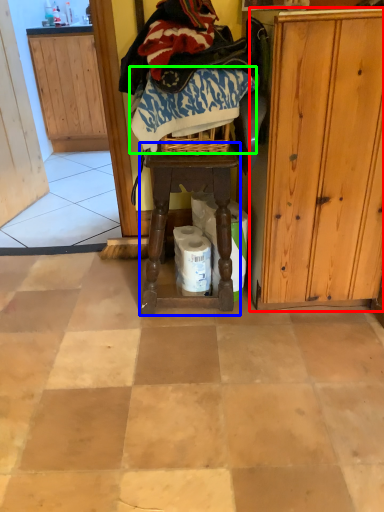
Question: Estimate the real-world distances between objects in this image. Which object is farther from cabinetry (highlighted by a red box), furniture (highlighted by a blue box) or clothing (highlighted by a green box)?

Choices:
 (A) furniture
 (B) clothing

Answer: (B)